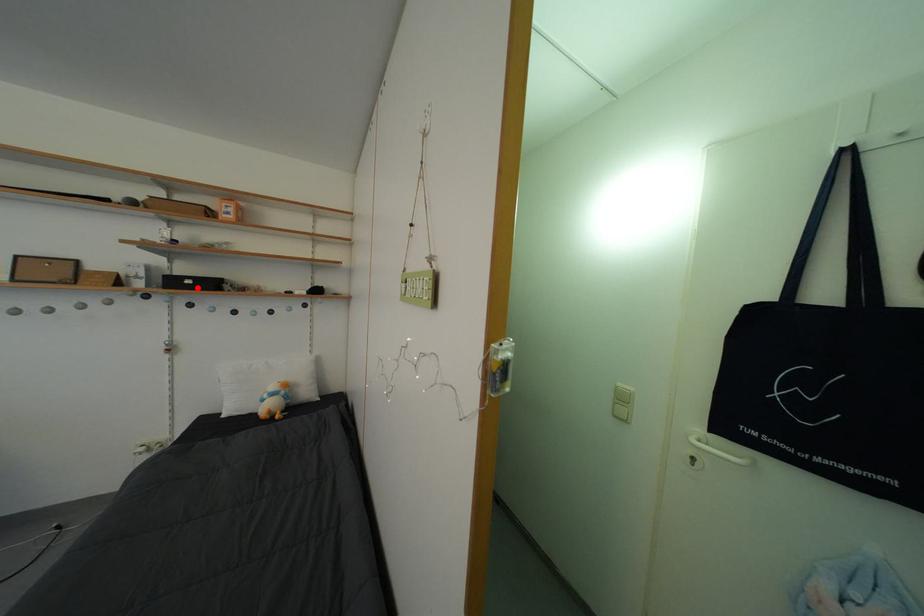
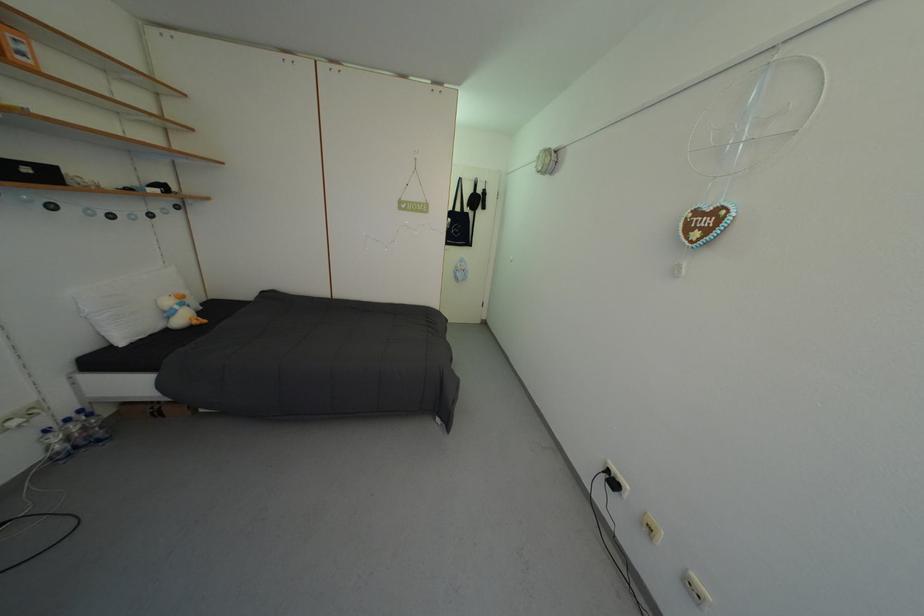
Question: A red point is marked in image1. In image2, is the corresponding 3D point closer to the camera or farther? Reply with the corresponding letter.

Choices:
 (A) The corresponding 3D point is closer.
 (B) The corresponding 3D point is farther.

Answer: (B)